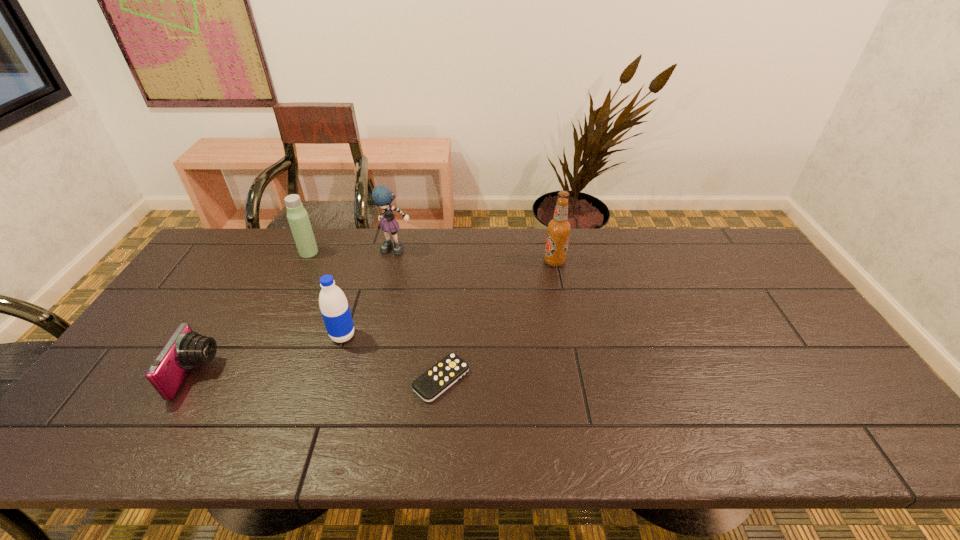
Image resolution: width=960 pixels, height=540 pixels. What are the coordinates of `free area in between the leftmost object and the fifth object from right to left` in the screenshot? It's located at (252, 313).

This screenshot has height=540, width=960. I want to click on vacant space that is in between the rightmost object and the thermos bottle, so click(x=432, y=257).

Identify which object is located as the fifth nearest to the third object from left to right. Please provide its 2D coordinates. Your answer should be formatted as a tuple, i.e. [(x, y)], where the tuple contains the x and y coordinates of a point satisfying the conditions above.

[(558, 229)]

Identify which object is the fourth nearest to the second object from left to right. Please provide its 2D coordinates. Your answer should be formatted as a tuple, i.e. [(x, y)], where the tuple contains the x and y coordinates of a point satisfying the conditions above.

[(431, 384)]

The image size is (960, 540). In order to click on free space that satisfies the following two spatial constraints: 1. on the front side of the fifth object from left to right; 2. on the right side of the fifth object from right to left in this screenshot , I will do `click(249, 379)`.

Locate an element on the screen. This screenshot has width=960, height=540. vacant space that satisfies the following two spatial constraints: 1. on the front-facing side of the shortest object; 2. on the right side of the fifth tallest object is located at coordinates (194, 379).

Image resolution: width=960 pixels, height=540 pixels. Identify the location of free space that satisfies the following two spatial constraints: 1. on the front side of the thermos bottle; 2. on the right side of the fifth object from left to right. (249, 379).

Where is `free space that satisfies the following two spatial constraints: 1. on the front-facing side of the shortest object; 2. on the left side of the fourth object from left to right`? The image size is (960, 540). free space that satisfies the following two spatial constraints: 1. on the front-facing side of the shortest object; 2. on the left side of the fourth object from left to right is located at coordinates (367, 379).

Identify the location of free space in the image that satisfies the following two spatial constraints: 1. on the front label of the beer bottle; 2. on the front side of the fifth object from left to right. The image size is (960, 540). (578, 379).